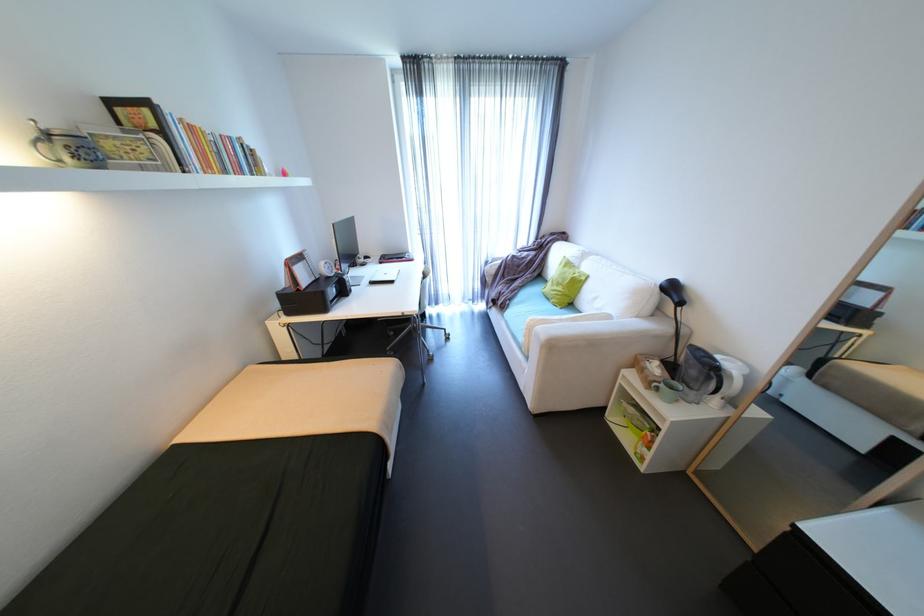
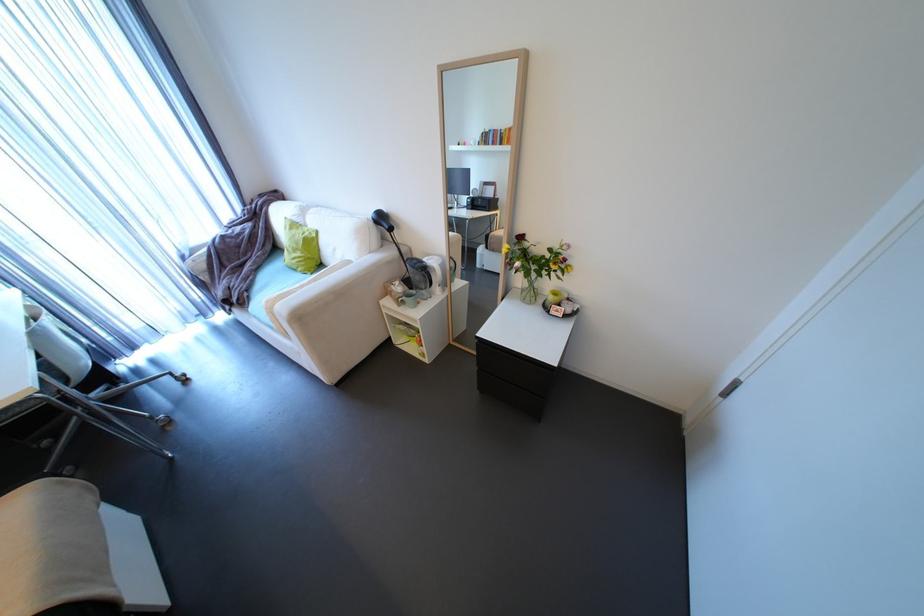
The point at (681, 379) is marked in the first image. Where is the corresponding point in the second image?

(419, 289)